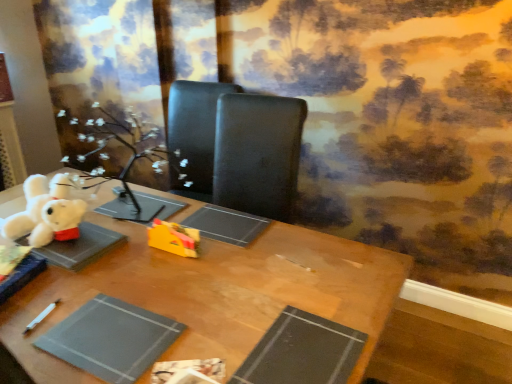
Image resolution: width=512 pixels, height=384 pixels. I want to click on black matte paperback book at lower center, marked as the second paperback book in a left-to-right arrangement, so click(302, 352).

What do you see at coordinates (111, 339) in the screenshot? Image resolution: width=512 pixels, height=384 pixels. I see `gray matte paper at lower left, which ranks as the 2th paperback book in right-to-left order` at bounding box center [111, 339].

Describe the element at coordinates (215, 292) in the screenshot. This screenshot has width=512, height=384. I see `wooden table at center` at that location.

The image size is (512, 384). I want to click on black matte paperback book at lower center, marked as the second paperback book in a left-to-right arrangement, so click(x=302, y=352).

Does yellow plastic toy at center, which appears as the second toy when viewed from the left, turn towards gray matte paper at lower left, which appears as the first paperback book when viewed from the left?

Yes.

Locate an element on the screen. toy that is the 2nd one when counting backward from the gray matte paper at lower left, which ranks as the 2th paperback book in right-to-left order is located at coordinates (173, 238).

Is yellow plastic toy at center, acting as the first toy starting from the right, beside gray matte paper at lower left, which ranks as the 2th paperback book in right-to-left order?

No.

Choose the correct answer: Is yellow plastic toy at center, acting as the first toy starting from the right, inside gray matte paper at lower left, which appears as the first paperback book when viewed from the left, or outside it?

yellow plastic toy at center, acting as the first toy starting from the right, is not enclosed by gray matte paper at lower left, which appears as the first paperback book when viewed from the left.

From a real-world perspective, which object rests below the other?

In real-world perspective, wooden table at center is lower.

How distant is wooden table at center from white plush bear at upper left, arranged as the 1th toy when viewed from the left?

36.93 centimeters.

Is wooden table at center spatially inside white plush bear at upper left, which appears as the 2th toy when viewed from the right, or outside of it?

wooden table at center exists outside the volume of white plush bear at upper left, which appears as the 2th toy when viewed from the right.

Which object is positioned more to the right, wooden table at center or white plush bear at upper left, arranged as the 1th toy when viewed from the left?

Positioned to the right is wooden table at center.

Is black matte paperback book at lower center, which is counted as the 1th paperback book, starting from the right, facing away from white plush bear at upper left, arranged as the 1th toy when viewed from the left?

No, black matte paperback book at lower center, which is counted as the 1th paperback book, starting from the right,'s orientation is not away from white plush bear at upper left, arranged as the 1th toy when viewed from the left.

Are black matte paperback book at lower center, marked as the second paperback book in a left-to-right arrangement, and white plush bear at upper left, arranged as the 1th toy when viewed from the left, making contact?

No, black matte paperback book at lower center, marked as the second paperback book in a left-to-right arrangement, is not next to white plush bear at upper left, arranged as the 1th toy when viewed from the left.

From the image's perspective, who appears lower, black matte paperback book at lower center, marked as the second paperback book in a left-to-right arrangement, or white plush bear at upper left, which appears as the 2th toy when viewed from the right?

black matte paperback book at lower center, marked as the second paperback book in a left-to-right arrangement, from the image's perspective.

What's the angular difference between black matte paperback book at lower center, marked as the second paperback book in a left-to-right arrangement, and white plush bear at upper left, which appears as the 2th toy when viewed from the right,'s facing directions?

They differ by 94 degrees in their facing directions.

Is white plush bear at upper left, which appears as the 2th toy when viewed from the right, in front of or behind gray matte paper at lower left, which appears as the first paperback book when viewed from the left, in the image?

In the image, white plush bear at upper left, which appears as the 2th toy when viewed from the right, appears behind gray matte paper at lower left, which appears as the first paperback book when viewed from the left.

In terms of width, does white plush bear at upper left, which appears as the 2th toy when viewed from the right, look wider or thinner when compared to gray matte paper at lower left, which appears as the first paperback book when viewed from the left?

Clearly, white plush bear at upper left, which appears as the 2th toy when viewed from the right, has less width compared to gray matte paper at lower left, which appears as the first paperback book when viewed from the left.

Is the surface of white plush bear at upper left, which appears as the 2th toy when viewed from the right, in direct contact with gray matte paper at lower left, which ranks as the 2th paperback book in right-to-left order?

There is a gap between white plush bear at upper left, which appears as the 2th toy when viewed from the right, and gray matte paper at lower left, which ranks as the 2th paperback book in right-to-left order.

From the image's perspective, between white plush bear at upper left, which appears as the 2th toy when viewed from the right, and gray matte paper at lower left, which appears as the first paperback book when viewed from the left, who is located below?

From the image's view, gray matte paper at lower left, which appears as the first paperback book when viewed from the left, is below.

Is black matte paperback book at lower center, which is counted as the 1th paperback book, starting from the right, inside the boundaries of gray matte paper at lower left, which ranks as the 2th paperback book in right-to-left order, or outside?

black matte paperback book at lower center, which is counted as the 1th paperback book, starting from the right, cannot be found inside gray matte paper at lower left, which ranks as the 2th paperback book in right-to-left order.

Is point (286, 378) behind point (118, 314)?

No, (286, 378) is closer to viewer.

How distant is black matte paperback book at lower center, marked as the second paperback book in a left-to-right arrangement, from gray matte paper at lower left, which appears as the first paperback book when viewed from the left?

black matte paperback book at lower center, marked as the second paperback book in a left-to-right arrangement, and gray matte paper at lower left, which appears as the first paperback book when viewed from the left, are 12.02 inches apart.

From the image's perspective, which one is positioned higher, black matte paperback book at lower center, marked as the second paperback book in a left-to-right arrangement, or gray matte paper at lower left, which appears as the first paperback book when viewed from the left?

From the image's view, gray matte paper at lower left, which appears as the first paperback book when viewed from the left, is above.

Does gray matte paper at lower left, which appears as the first paperback book when viewed from the left, turn towards black matte paperback book at lower center, which is counted as the 1th paperback book, starting from the right?

No, gray matte paper at lower left, which appears as the first paperback book when viewed from the left, is not oriented towards black matte paperback book at lower center, which is counted as the 1th paperback book, starting from the right.

Based on their sizes in the image, would you say gray matte paper at lower left, which ranks as the 2th paperback book in right-to-left order, is bigger or smaller than black matte paperback book at lower center, marked as the second paperback book in a left-to-right arrangement?

gray matte paper at lower left, which ranks as the 2th paperback book in right-to-left order, is bigger than black matte paperback book at lower center, marked as the second paperback book in a left-to-right arrangement.

Between gray matte paper at lower left, which appears as the first paperback book when viewed from the left, and black matte paperback book at lower center, which is counted as the 1th paperback book, starting from the right, which one has less height?

black matte paperback book at lower center, which is counted as the 1th paperback book, starting from the right, is shorter.

From the image's perspective, would you say gray matte paper at lower left, which appears as the first paperback book when viewed from the left, is shown under black matte paperback book at lower center, which is counted as the 1th paperback book, starting from the right?

No.

From the image's perspective, which object appears higher, gray matte paper at lower left, which appears as the first paperback book when viewed from the left, or yellow plastic toy at center, acting as the first toy starting from the right?

yellow plastic toy at center, acting as the first toy starting from the right, from the image's perspective.

In order to click on paperback book on the left of yellow plastic toy at center, which appears as the second toy when viewed from the left in this screenshot , I will do `click(111, 339)`.

Looking at this image, considering the positions of objects gray matte paper at lower left, which appears as the first paperback book when viewed from the left, and yellow plastic toy at center, which appears as the second toy when viewed from the left, in the image provided, who is more to the left, gray matte paper at lower left, which appears as the first paperback book when viewed from the left, or yellow plastic toy at center, which appears as the second toy when viewed from the left,?

gray matte paper at lower left, which appears as the first paperback book when viewed from the left, is more to the left.

Find the location of a particular element. the 1st toy above the gray matte paper at lower left, which appears as the first paperback book when viewed from the left (from the image's perspective) is located at coordinates (173, 238).

At what (x,y) coordinates should I click in order to perform the action: click on table below the white plush bear at upper left, arranged as the 1th toy when viewed from the left (from the image's perspective). Please return your answer as a coordinate pair (x, y). The width and height of the screenshot is (512, 384). Looking at the image, I should click on (215, 292).

From the image, which object appears to be nearer to yellow plastic toy at center, which appears as the second toy when viewed from the left, white plush bear at upper left, which appears as the 2th toy when viewed from the right, or black matte paperback book at lower center, which is counted as the 1th paperback book, starting from the right?

white plush bear at upper left, which appears as the 2th toy when viewed from the right, is positioned closer to the anchor yellow plastic toy at center, which appears as the second toy when viewed from the left.

Considering their positions, is gray matte paper at lower left, which appears as the first paperback book when viewed from the left, positioned further to black matte paperback book at lower center, which is counted as the 1th paperback book, starting from the right, than wooden table at center?

gray matte paper at lower left, which appears as the first paperback book when viewed from the left, is positioned further to the anchor black matte paperback book at lower center, which is counted as the 1th paperback book, starting from the right.

Estimate the real-world distances between objects in this image. Which object is closer to white plush bear at upper left, which appears as the 2th toy when viewed from the right, wooden table at center or yellow plastic toy at center, acting as the first toy starting from the right?

yellow plastic toy at center, acting as the first toy starting from the right, is positioned closer to the anchor white plush bear at upper left, which appears as the 2th toy when viewed from the right.

From the image, which object appears to be farther from white plush bear at upper left, arranged as the 1th toy when viewed from the left, black matte paperback book at lower center, which is counted as the 1th paperback book, starting from the right, or yellow plastic toy at center, which appears as the second toy when viewed from the left?

Based on the image, black matte paperback book at lower center, which is counted as the 1th paperback book, starting from the right, appears to be further to white plush bear at upper left, arranged as the 1th toy when viewed from the left.

Considering their positions, is wooden table at center positioned further to black matte paperback book at lower center, which is counted as the 1th paperback book, starting from the right, than white plush bear at upper left, arranged as the 1th toy when viewed from the left?

white plush bear at upper left, arranged as the 1th toy when viewed from the left.

From the image, which object appears to be nearer to gray matte paper at lower left, which appears as the first paperback book when viewed from the left, white plush bear at upper left, which appears as the 2th toy when viewed from the right, or wooden table at center?

wooden table at center lies closer to gray matte paper at lower left, which appears as the first paperback book when viewed from the left, than the other object.

Consider the image. Looking at the image, which one is located further to black matte paperback book at lower center, marked as the second paperback book in a left-to-right arrangement, yellow plastic toy at center, acting as the first toy starting from the right, or gray matte paper at lower left, which ranks as the 2th paperback book in right-to-left order?

Based on the image, yellow plastic toy at center, acting as the first toy starting from the right, appears to be further to black matte paperback book at lower center, marked as the second paperback book in a left-to-right arrangement.

When comparing their distances from gray matte paper at lower left, which ranks as the 2th paperback book in right-to-left order, does black matte paperback book at lower center, marked as the second paperback book in a left-to-right arrangement, or yellow plastic toy at center, which appears as the second toy when viewed from the left, seem closer?

black matte paperback book at lower center, marked as the second paperback book in a left-to-right arrangement, is positioned closer to the anchor gray matte paper at lower left, which ranks as the 2th paperback book in right-to-left order.

Where is `toy located between wooden table at center and yellow plastic toy at center, acting as the first toy starting from the right, in the depth direction`? This screenshot has height=384, width=512. toy located between wooden table at center and yellow plastic toy at center, acting as the first toy starting from the right, in the depth direction is located at coordinates click(46, 212).

This screenshot has height=384, width=512. I want to click on toy between gray matte paper at lower left, which appears as the first paperback book when viewed from the left, and yellow plastic toy at center, which appears as the second toy when viewed from the left, along the z-axis, so click(x=46, y=212).

Identify the location of paperback book between black matte paperback book at lower center, which is counted as the 1th paperback book, starting from the right, and yellow plastic toy at center, which appears as the second toy when viewed from the left, along the z-axis. tap(111, 339).

You are a GUI agent. You are given a task and a screenshot of the screen. Output one action in this format:
    pyautogui.click(x=<x>, y=<y>)
    Task: Click on the paperback book between wooden table at center and black matte paperback book at lower center, which is counted as the 1th paperback book, starting from the right, in the horizontal direction
    The image size is (512, 384).
    Given the screenshot: What is the action you would take?
    pyautogui.click(x=111, y=339)